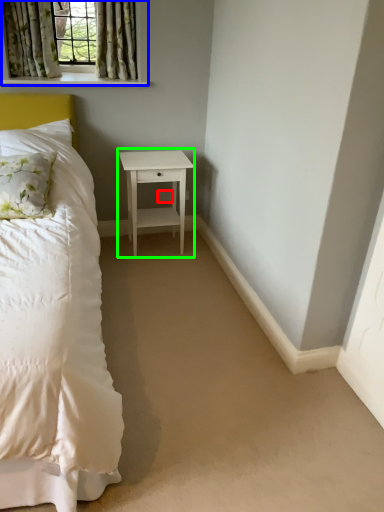
Question: Estimate the real-world distances between objects in this image. Which object is farther from electric outlet (highlighted by a red box), window (highlighted by a blue box) or nightstand (highlighted by a green box)?

Choices:
 (A) window
 (B) nightstand

Answer: (A)